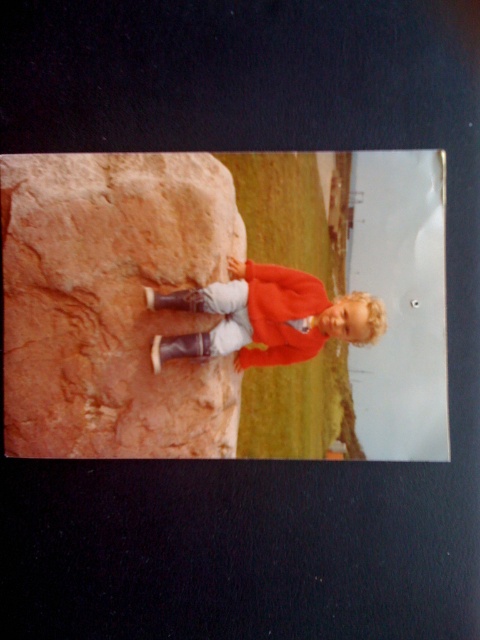
Does rustic brown rock at left have a greater height compared to matte red jacket at center?

Correct, rustic brown rock at left is much taller as matte red jacket at center.

Measure the distance from rustic brown rock at left to matte red jacket at center.

They are 4.53 inches apart.

Which is behind, point (128, 352) or point (216, 352)?

The point (216, 352) is behind.

The width and height of the screenshot is (480, 640). In order to click on rustic brown rock at left in this screenshot , I will do `click(112, 304)`.